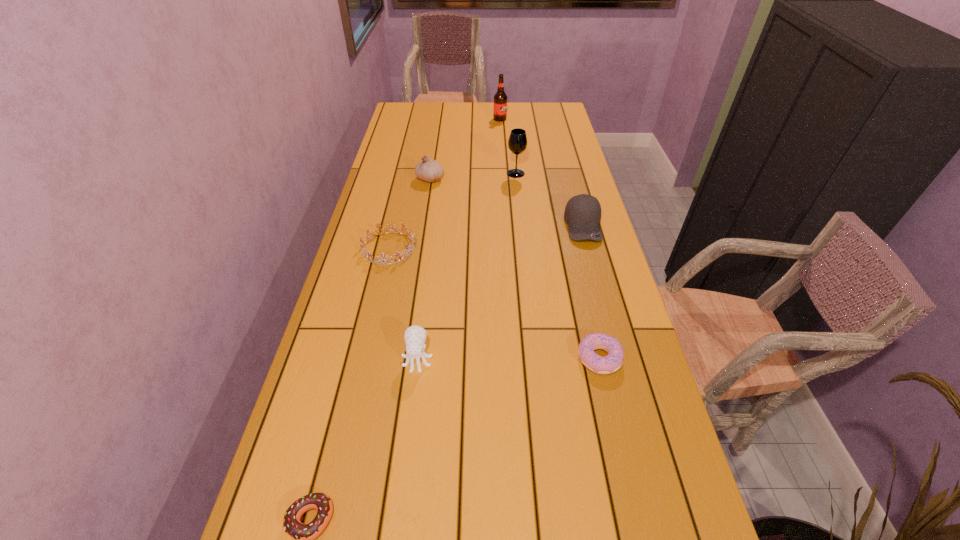
Find the location of a particular element. The width and height of the screenshot is (960, 540). free point located 0.370m on the front brim of the baseball cap is located at coordinates (615, 339).

The width and height of the screenshot is (960, 540). I want to click on free space located 0.210m on the front-facing side of the octopus, so click(x=405, y=463).

You are a GUI agent. You are given a task and a screenshot of the screen. Output one action in this format:
    pyautogui.click(x=<x>, y=<y>)
    Task: Click on the free spot located on the front-facing side of the sixth tallest object
    The width and height of the screenshot is (960, 540).
    Given the screenshot: What is the action you would take?
    pyautogui.click(x=445, y=248)

You are a GUI agent. You are given a task and a screenshot of the screen. Output one action in this format:
    pyautogui.click(x=<x>, y=<y>)
    Task: Click on the free space located on the back of the right doughnut
    This screenshot has height=540, width=960.
    Given the screenshot: What is the action you would take?
    pyautogui.click(x=581, y=277)

Where is `object at the far edge`? object at the far edge is located at coordinates (500, 98).

At what (x,y) coordinates should I click in order to perform the action: click on garlic at the left edge. Please return your answer as a coordinate pair (x, y). Looking at the image, I should click on (428, 170).

Locate an element on the screen. tiara at the left edge is located at coordinates (412, 238).

This screenshot has height=540, width=960. I want to click on baseball cap that is at the right edge, so click(x=582, y=213).

You are a GUI agent. You are given a task and a screenshot of the screen. Output one action in this format:
    pyautogui.click(x=<x>, y=<y>)
    Task: Click on the doughnut present at the right edge
    The height and width of the screenshot is (540, 960).
    Given the screenshot: What is the action you would take?
    pyautogui.click(x=612, y=362)

Identify the location of vacant position at the far edge of the desktop. (516, 107).